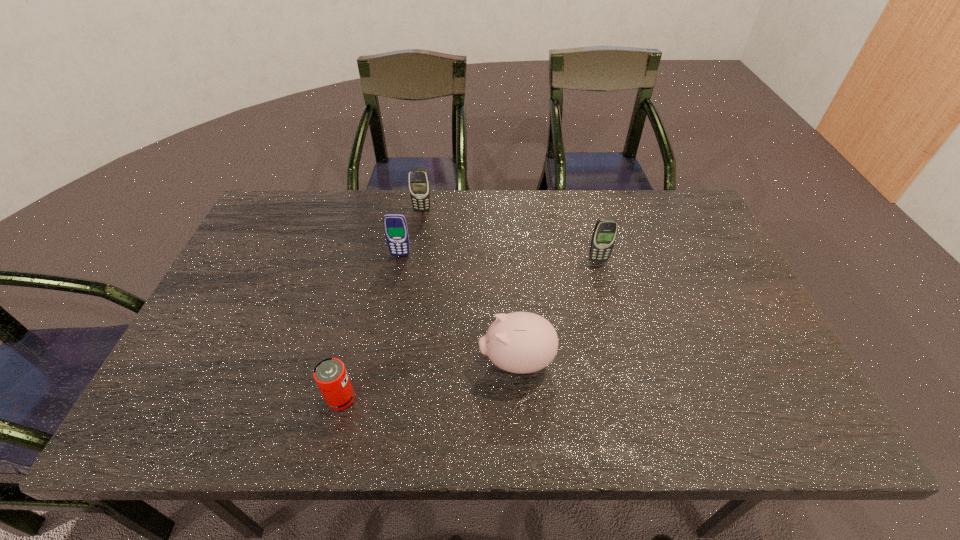
Identify the location of vacant space that is in between the fourth nearest object and the shortest object. (371, 327).

Identify which object is located as the second nearest to the second farthest cellular telephone. Please provide its 2D coordinates. Your answer should be formatted as a tuple, i.e. [(x, y)], where the tuple contains the x and y coordinates of a point satisfying the conditions above.

[(519, 342)]

At what (x,y) coordinates should I click in order to perform the action: click on the closest object relative to the fourth object from left to right. Please return your answer as a coordinate pair (x, y). Looking at the image, I should click on (330, 374).

You are a GUI agent. You are given a task and a screenshot of the screen. Output one action in this format:
    pyautogui.click(x=<x>, y=<y>)
    Task: Click on the cellular telephone that is the nearest to the rightmost object
    This screenshot has width=960, height=540.
    Given the screenshot: What is the action you would take?
    (x=395, y=225)

This screenshot has width=960, height=540. In order to click on cellular telephone that stands as the closest to the shortest object in this screenshot , I will do `click(395, 225)`.